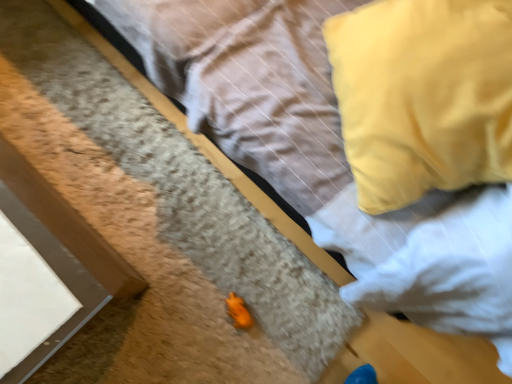
This screenshot has width=512, height=384. What do you see at coordinates (238, 312) in the screenshot? I see `orange matte toy frog at lower center` at bounding box center [238, 312].

Image resolution: width=512 pixels, height=384 pixels. In order to click on orange matte toy frog at lower center in this screenshot , I will do `click(238, 312)`.

Locate an element on the screen. This screenshot has width=512, height=384. yellow fabric pillow at upper right is located at coordinates (423, 96).

Image resolution: width=512 pixels, height=384 pixels. Describe the element at coordinates (423, 96) in the screenshot. I see `yellow fabric pillow at upper right` at that location.

You are a GUI agent. You are given a task and a screenshot of the screen. Output one action in this format:
    pyautogui.click(x=<x>, y=<y>)
    Task: Click on the orange matte toy frog at lower center
    This screenshot has width=512, height=384.
    Given the screenshot: What is the action you would take?
    pyautogui.click(x=238, y=312)

Between yellow fabric pillow at upper right and orange matte toy frog at lower center, which one appears on the left side from the viewer's perspective?

From the viewer's perspective, orange matte toy frog at lower center appears more on the left side.

Considering the relative positions of yellow fabric pillow at upper right and orange matte toy frog at lower center in the image provided, is yellow fabric pillow at upper right in front of orange matte toy frog at lower center?

Yes, yellow fabric pillow at upper right is closer to the viewer.

Is point (461, 47) closer or farther from the camera than point (228, 302)?

Point (461, 47) is closer to the camera than point (228, 302).

From the image's perspective, is yellow fabric pillow at upper right located above orange matte toy frog at lower center?

Yes, from the image's perspective, yellow fabric pillow at upper right is over orange matte toy frog at lower center.

From a real-world perspective, between yellow fabric pillow at upper right and orange matte toy frog at lower center, who is vertically lower?

From a 3D spatial view, orange matte toy frog at lower center is below.

Considering the sizes of objects yellow fabric pillow at upper right and orange matte toy frog at lower center in the image provided, who is wider, yellow fabric pillow at upper right or orange matte toy frog at lower center?

yellow fabric pillow at upper right is wider.

Which of these two, yellow fabric pillow at upper right or orange matte toy frog at lower center, stands shorter?

With less height is orange matte toy frog at lower center.

In terms of size, does yellow fabric pillow at upper right appear bigger or smaller than orange matte toy frog at lower center?

Clearly, yellow fabric pillow at upper right is larger in size than orange matte toy frog at lower center.

Could orange matte toy frog at lower center be considered to be inside yellow fabric pillow at upper right?

No, yellow fabric pillow at upper right does not contain orange matte toy frog at lower center.

Would you say yellow fabric pillow at upper right is a long distance from orange matte toy frog at lower center?

No.

Is yellow fabric pillow at upper right facing away from orange matte toy frog at lower center?

No, yellow fabric pillow at upper right is not facing the opposite direction of orange matte toy frog at lower center.

Where is `miniature that is below the yellow fabric pillow at upper right (from the image's perspective)`? This screenshot has height=384, width=512. miniature that is below the yellow fabric pillow at upper right (from the image's perspective) is located at coordinates (238, 312).

Is orange matte toy frog at lower center at the left side of yellow fabric pillow at upper right?

Yes.

Considering the relative positions of orange matte toy frog at lower center and yellow fabric pillow at upper right in the image provided, is orange matte toy frog at lower center behind yellow fabric pillow at upper right?

That is True.

Is point (244, 311) closer or farther from the camera than point (350, 102)?

Point (244, 311) is farther from the camera than point (350, 102).

Consider the image. From the image's perspective, between orange matte toy frog at lower center and yellow fabric pillow at upper right, who is located below?

orange matte toy frog at lower center is shown below in the image.

From a real-world perspective, which is physically above, orange matte toy frog at lower center or yellow fabric pillow at upper right?

yellow fabric pillow at upper right, from a real-world perspective.

Which of these two, orange matte toy frog at lower center or yellow fabric pillow at upper right, is thinner?

Thinner between the two is orange matte toy frog at lower center.

Does orange matte toy frog at lower center have a lesser height compared to yellow fabric pillow at upper right?

Yes.

Is orange matte toy frog at lower center bigger than yellow fabric pillow at upper right?

Actually, orange matte toy frog at lower center might be smaller than yellow fabric pillow at upper right.

Is orange matte toy frog at lower center outside of yellow fabric pillow at upper right?

Yes, orange matte toy frog at lower center is not within yellow fabric pillow at upper right.

Are orange matte toy frog at lower center and yellow fabric pillow at upper right located far from each other?

No, there isn't a large distance between orange matte toy frog at lower center and yellow fabric pillow at upper right.

Is orange matte toy frog at lower center oriented towards yellow fabric pillow at upper right?

No, orange matte toy frog at lower center is not oriented towards yellow fabric pillow at upper right.

Measure the distance from orange matte toy frog at lower center to yellow fabric pillow at upper right.

They are 27.74 inches apart.

The height and width of the screenshot is (384, 512). In order to click on pillow on the right of orange matte toy frog at lower center in this screenshot , I will do `click(423, 96)`.

At what (x,y) coordinates should I click in order to perform the action: click on miniature on the left of yellow fabric pillow at upper right. Please return your answer as a coordinate pair (x, y). Image resolution: width=512 pixels, height=384 pixels. Looking at the image, I should click on (238, 312).

You are a GUI agent. You are given a task and a screenshot of the screen. Output one action in this format:
    pyautogui.click(x=<x>, y=<y>)
    Task: Click on the miniature below the yellow fabric pillow at upper right (from a real-world perspective)
    Image resolution: width=512 pixels, height=384 pixels.
    Given the screenshot: What is the action you would take?
    pyautogui.click(x=238, y=312)